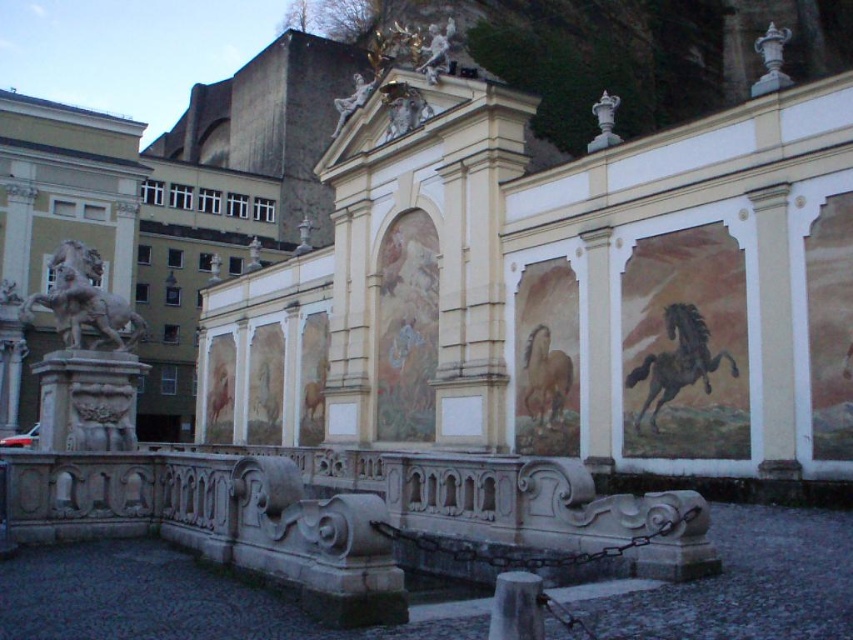
Question: Which of the following is the closest to the observer?

Choices:
 (A) (230, 394)
 (B) (666, 362)
 (C) (114, 312)

Answer: (C)

Question: Which of the following is the closest to the observer?

Choices:
 (A) (712, 358)
 (B) (550, 337)
 (C) (96, 289)
 (D) (207, 412)

Answer: (C)

Question: Can you confirm if white marble horse at left is smaller than golden metallic horse at center?

Choices:
 (A) no
 (B) yes

Answer: (A)

Question: Which point is closer to the camera taking this photo?

Choices:
 (A) click(x=78, y=285)
 (B) click(x=231, y=401)
 (C) click(x=547, y=330)
 (D) click(x=732, y=368)

Answer: (A)

Question: Does white marble horse at left lie behind black glossy horse at center right?

Choices:
 (A) no
 (B) yes

Answer: (A)

Question: Can you confirm if white marble horse at left is thinner than light brown painted horse at center?

Choices:
 (A) no
 (B) yes

Answer: (A)